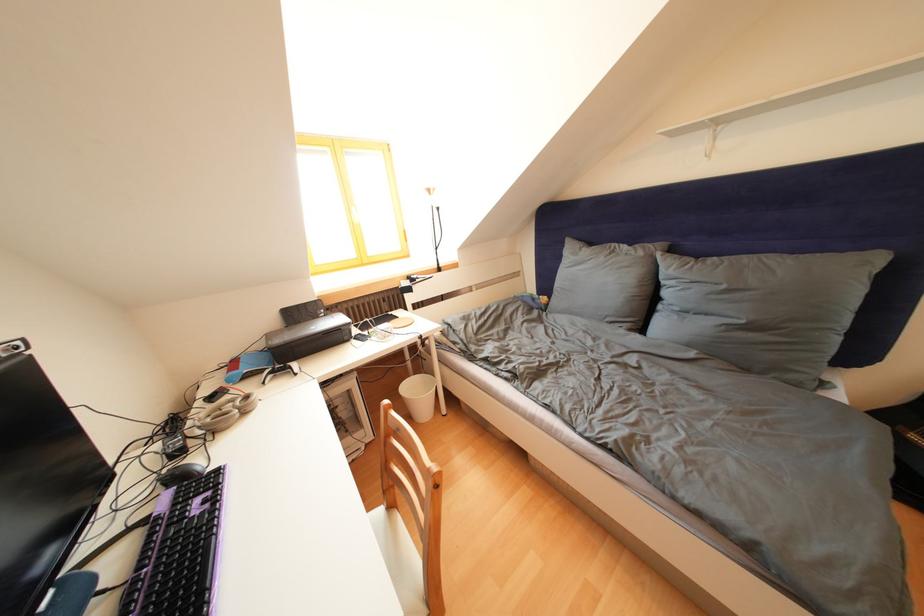
The location [225,411] corresponds to which object?

It refers to a white game controller.